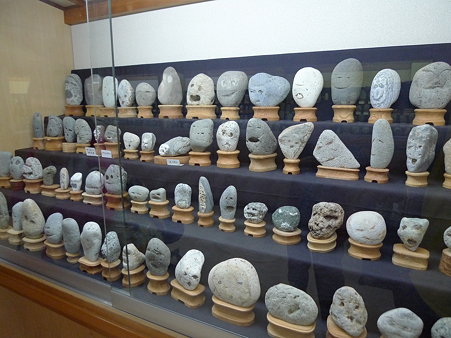
Find the location of a particular element. The width and height of the screenshot is (451, 338). frame is located at coordinates (91, 314), (13, 281), (133, 335).